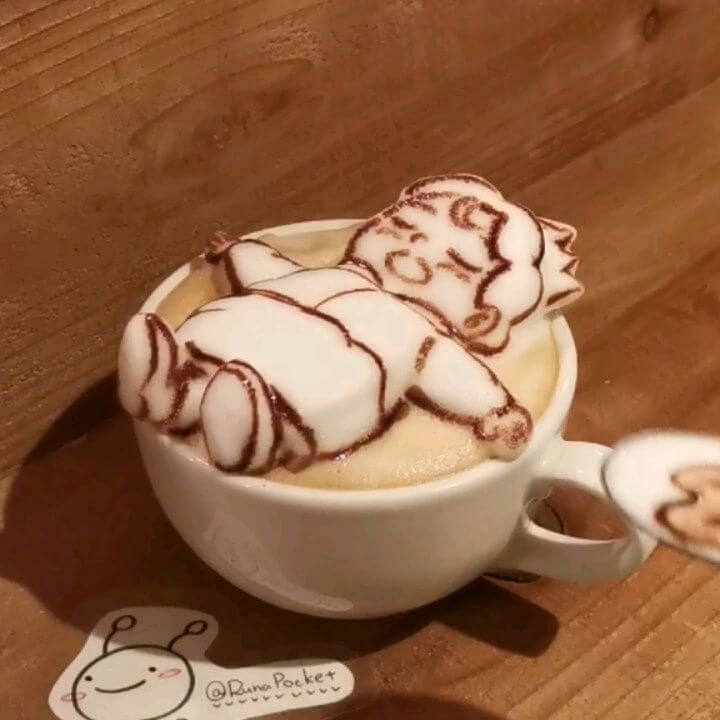
Locate an element on the screen. The height and width of the screenshot is (720, 720). mug is located at coordinates (420, 558).